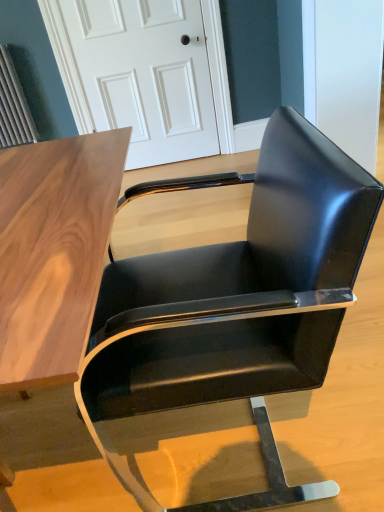
Identify the location of vacant space underneath glossy black chair at center (from a real-world perspective). (218, 445).